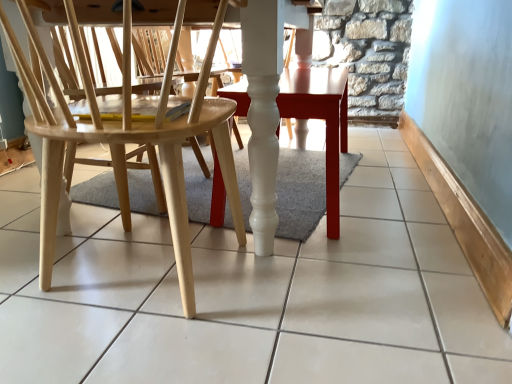
The height and width of the screenshot is (384, 512). I want to click on free space to the right of natural wood chair at left, so click(334, 290).